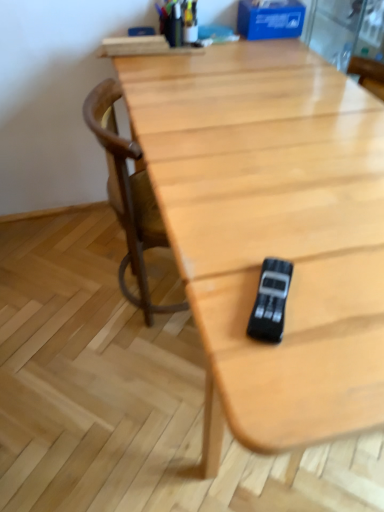
This screenshot has width=384, height=512. What are the coordinates of `black plastic game controller at center` in the screenshot? It's located at [x=270, y=301].

Describe the element at coordinates (270, 301) in the screenshot. I see `black plastic game controller at center` at that location.

The width and height of the screenshot is (384, 512). What do you see at coordinates (128, 195) in the screenshot?
I see `wooden chair at center` at bounding box center [128, 195].

Looking at this image, measure the distance between point (113,115) and camera.

Point (113,115) is 1.29 meters from camera.

Image resolution: width=384 pixels, height=512 pixels. I want to click on wooden chair at center, so click(128, 195).

Where is `black plastic game controller at center`? The image size is (384, 512). black plastic game controller at center is located at coordinates (270, 301).

Considering the relative positions of black plastic game controller at center and wooden chair at center in the image provided, is black plastic game controller at center to the left of wooden chair at center from the viewer's perspective?

No.

Which is behind, black plastic game controller at center or wooden chair at center?

wooden chair at center is further from the camera.

Is point (285, 296) positioned behind point (124, 185)?

No, (285, 296) is closer to viewer.

From the image's perspective, would you say black plastic game controller at center is shown under wooden chair at center?

Yes, from the image's perspective, black plastic game controller at center is beneath wooden chair at center.

Consider the image. From a real-world perspective, is black plastic game controller at center physically below wooden chair at center?

Actually, black plastic game controller at center is physically above wooden chair at center in the real world.

Which object is wider, black plastic game controller at center or wooden chair at center?

wooden chair at center.

Who is shorter, black plastic game controller at center or wooden chair at center?

Standing shorter between the two is black plastic game controller at center.

Does black plastic game controller at center have a smaller size compared to wooden chair at center?

Indeed, black plastic game controller at center has a smaller size compared to wooden chair at center.

Is wooden chair at center inside black plastic game controller at center?

That's incorrect, wooden chair at center is not inside black plastic game controller at center.

Is black plastic game controller at center not close to wooden chair at center?

No, black plastic game controller at center is in close proximity to wooden chair at center.

Could you tell me if black plastic game controller at center is facing wooden chair at center?

No, black plastic game controller at center does not turn towards wooden chair at center.

Can you tell me how much black plastic game controller at center and wooden chair at center differ in facing direction?

27 degrees separate the facing orientations of black plastic game controller at center and wooden chair at center.

Identify the location of game controller lying in front of the wooden chair at center. (270, 301).

In the image, is wooden chair at center on the left side or the right side of black plastic game controller at center?

wooden chair at center is positioned on black plastic game controller at center's left side.

Considering the positions of objects wooden chair at center and black plastic game controller at center in the image provided, who is in front, wooden chair at center or black plastic game controller at center?

black plastic game controller at center is closer to the camera.

Which is closer, (x=91, y=100) or (x=286, y=291)?

Point (x=91, y=100).

From the image's perspective, is wooden chair at center over black plastic game controller at center?

Yes.

Based on the photo, from a real-world perspective, is wooden chair at center located higher than black plastic game controller at center?

No, from a real-world perspective, wooden chair at center is not on top of black plastic game controller at center.

Consider the image. In terms of width, does wooden chair at center look wider or thinner when compared to black plastic game controller at center?

Considering their sizes, wooden chair at center looks broader than black plastic game controller at center.

Can you confirm if wooden chair at center is shorter than black plastic game controller at center?

No.

Is wooden chair at center bigger or smaller than black plastic game controller at center?

In the image, wooden chair at center appears to be larger than black plastic game controller at center.

Consider the image. Is black plastic game controller at center completely or partially inside wooden chair at center?

No, black plastic game controller at center is not a part of wooden chair at center.

Is wooden chair at center far from black plastic game controller at center?

Actually, wooden chair at center and black plastic game controller at center are a little close together.

Is wooden chair at center facing towards black plastic game controller at center?

No, wooden chair at center is not aimed at black plastic game controller at center.

What's the angular difference between wooden chair at center and black plastic game controller at center's facing directions?

There is a 27-degree angle between the facing directions of wooden chair at center and black plastic game controller at center.

Locate an element on the screen. Image resolution: width=384 pixels, height=512 pixels. chair above the black plastic game controller at center (from the image's perspective) is located at coordinates (128, 195).

What are the coordinates of `chair below the black plastic game controller at center (from a real-world perspective)` in the screenshot? It's located at (128, 195).

Find the location of a particular element. Image resolution: width=384 pixels, height=512 pixels. game controller that is below the wooden chair at center (from the image's perspective) is located at coordinates (270, 301).